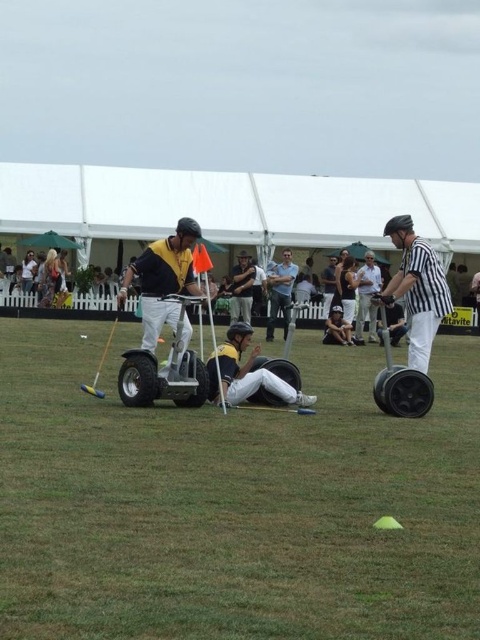
You are a photographer positioned at the edge of the field. You want to take a photo that includes both the matte yellow helmet at center and the white striped shirt at center. Which object should you focus on first to ensure both are in frame?

The matte yellow helmet at center has a smaller size compared to white striped shirt at center, so you should focus on the larger white striped shirt at center first to ensure both fit within the frame.

You are a photographer positioned at the edge of the field, aiming to capture a photo of the matte yellow helmet at center and the black rubber segway at right. To ensure both subjects are in the frame, should you adjust your camera to focus on the left side or the right side?

Since the matte yellow helmet at center is to the left of the black rubber segway at right, you should focus on the right side to include both subjects in the frame.